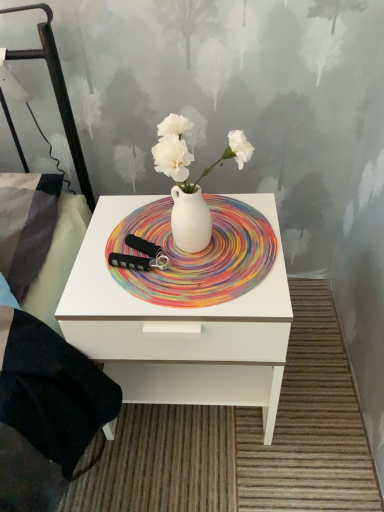
The height and width of the screenshot is (512, 384). In order to click on vacant space situated on the left part of white matte vase at center in this screenshot , I will do `click(127, 250)`.